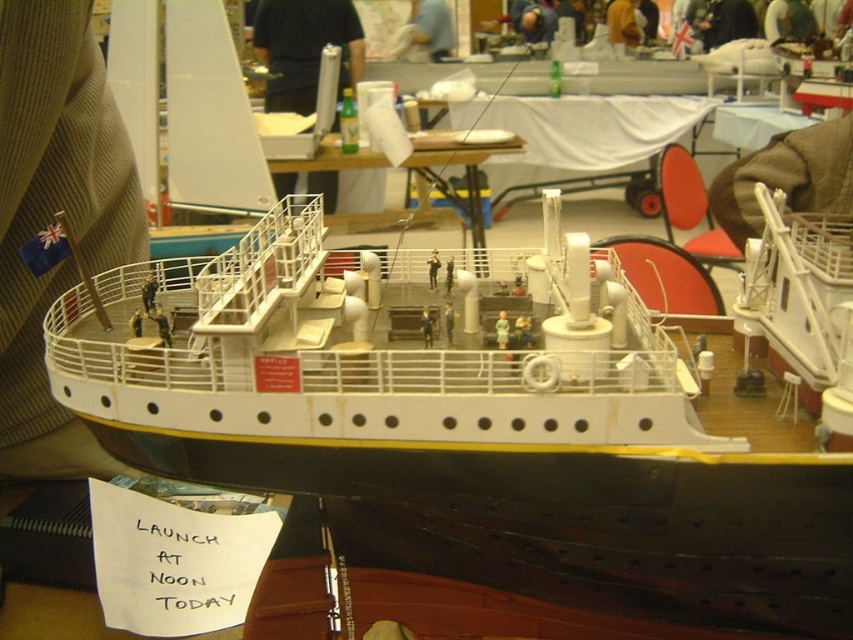
Does point (561, 540) come in front of point (469, 198)?

Yes, point (561, 540) is closer to viewer.

Who is more forward, (648, 380) or (442, 163)?

Point (648, 380)

In order to click on white plastic ship at center in this screenshot , I will do pos(467,436).

Consider the image. Who is more forward, (x=679, y=449) or (x=570, y=134)?

Point (x=679, y=449) is in front.

Does white plastic ship at center appear on the right side of white fabric table at center?

No, white plastic ship at center is not to the right of white fabric table at center.

At what (x,y) coordinates should I click in order to perform the action: click on white plastic ship at center. Please return your answer as a coordinate pair (x, y). This screenshot has width=853, height=640. Looking at the image, I should click on (467, 436).

Where is `white plastic ship at center`? The height and width of the screenshot is (640, 853). white plastic ship at center is located at coordinates (467, 436).

Is white fabric table at center to the left of white plastic table at center from the viewer's perspective?

No, white fabric table at center is not to the left of white plastic table at center.

Is point (596, 132) positioned behind point (438, 189)?

Yes, it is.

Which is in front, point (583, 134) or point (402, 225)?

Point (402, 225) is more forward.

At what (x,y) coordinates should I click in order to perform the action: click on white fabric table at center. Please return your answer as a coordinate pair (x, y). Looking at the image, I should click on (578, 140).